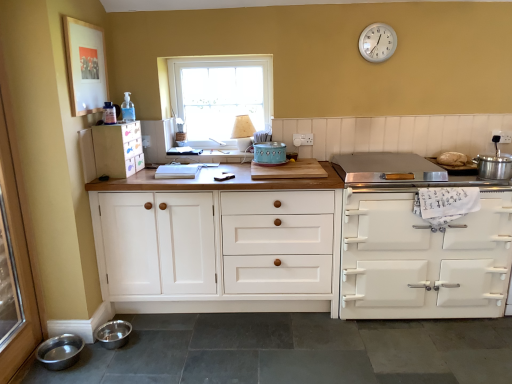
Question: From a real-world perspective, is stainless steel cooker at right, which is the 2th appliance from right to left, on white glossy stove at right, which ranks as the 3th cabinetry in left-to-right order?

Choices:
 (A) no
 (B) yes

Answer: (B)

Question: Considering the relative sizes of stainless steel cooker at right, positioned as the second appliance in left-to-right order, and white glossy stove at right, which ranks as the 3th cabinetry in left-to-right order, in the image provided, is stainless steel cooker at right, positioned as the second appliance in left-to-right order, taller than white glossy stove at right, which ranks as the 3th cabinetry in left-to-right order,?

Choices:
 (A) yes
 (B) no

Answer: (B)

Question: Does stainless steel cooker at right, which is the 2th appliance from right to left, have a lesser width compared to white glossy stove at right, the first cabinetry in the right-to-left sequence?

Choices:
 (A) yes
 (B) no

Answer: (A)

Question: Is stainless steel cooker at right, which is the 2th appliance from right to left, located outside white glossy stove at right, the first cabinetry in the right-to-left sequence?

Choices:
 (A) yes
 (B) no

Answer: (A)

Question: Does stainless steel cooker at right, positioned as the second appliance in left-to-right order, have a greater width compared to white glossy stove at right, which ranks as the 3th cabinetry in left-to-right order?

Choices:
 (A) yes
 (B) no

Answer: (B)

Question: Considering the relative positions of stainless steel cooker at right, which is the 2th appliance from right to left, and white glossy stove at right, which ranks as the 3th cabinetry in left-to-right order, in the image provided, is stainless steel cooker at right, which is the 2th appliance from right to left, behind white glossy stove at right, which ranks as the 3th cabinetry in left-to-right order,?

Choices:
 (A) yes
 (B) no

Answer: (B)

Question: Considering the relative positions of white painted wood cabinet at left, the first cabinetry when ordered from left to right, and stainless steel cooker at right, positioned as the second appliance in left-to-right order, in the image provided, is white painted wood cabinet at left, the first cabinetry when ordered from left to right, in front of stainless steel cooker at right, positioned as the second appliance in left-to-right order,?

Choices:
 (A) yes
 (B) no

Answer: (B)

Question: Is white painted wood cabinet at left, the first cabinetry when ordered from left to right, thinner than stainless steel cooker at right, positioned as the second appliance in left-to-right order?

Choices:
 (A) no
 (B) yes

Answer: (B)

Question: Is white painted wood cabinet at left, which is the third cabinetry in right-to-left order, not near stainless steel cooker at right, which is the 2th appliance from right to left?

Choices:
 (A) yes
 (B) no

Answer: (A)

Question: Can you confirm if white painted wood cabinet at left, which is the third cabinetry in right-to-left order, is bigger than stainless steel cooker at right, positioned as the second appliance in left-to-right order?

Choices:
 (A) no
 (B) yes

Answer: (A)

Question: Can you confirm if white painted wood cabinet at left, the first cabinetry when ordered from left to right, is positioned to the right of stainless steel cooker at right, which is the 2th appliance from right to left?

Choices:
 (A) no
 (B) yes

Answer: (A)

Question: From a real-world perspective, is white painted wood cabinet at left, the first cabinetry when ordered from left to right, physically above stainless steel cooker at right, which is the 2th appliance from right to left?

Choices:
 (A) yes
 (B) no

Answer: (A)

Question: Does white wood cabinet at center, the 2th cabinetry in the left-to-right sequence, appear on the left side of stainless steel cooker at right, which is the 2th appliance from right to left?

Choices:
 (A) yes
 (B) no

Answer: (A)